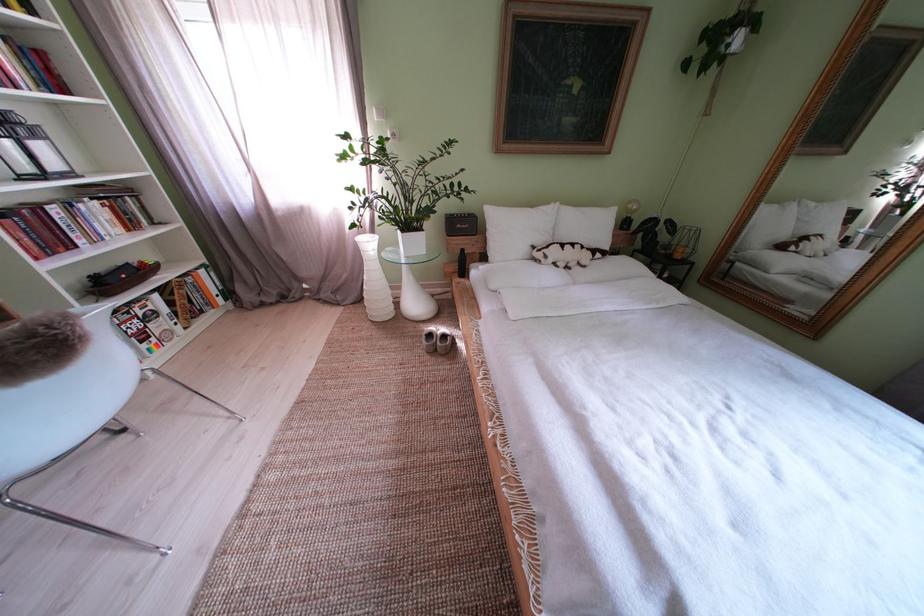
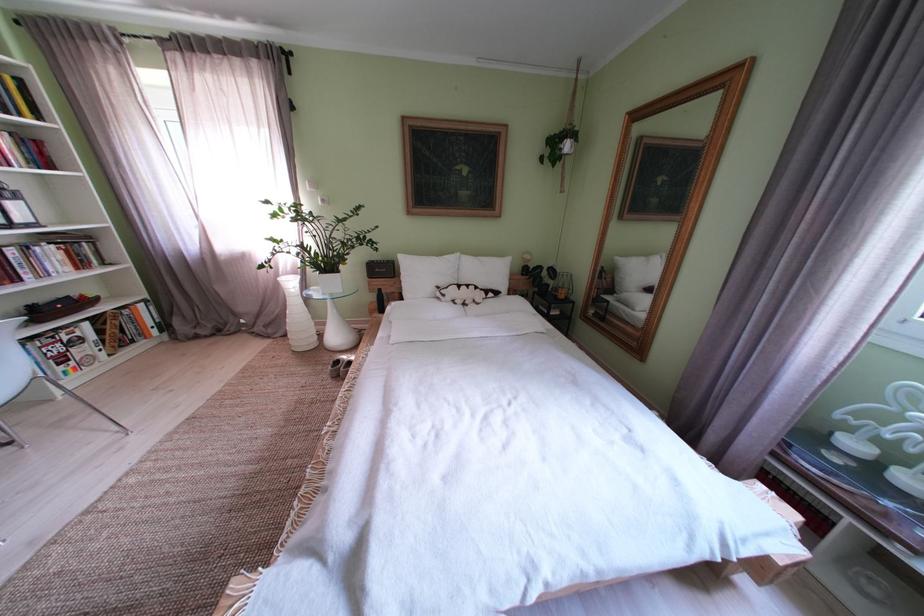
The point at (x=594, y=215) is marked in the first image. Where is the corresponding point in the second image?

(492, 264)